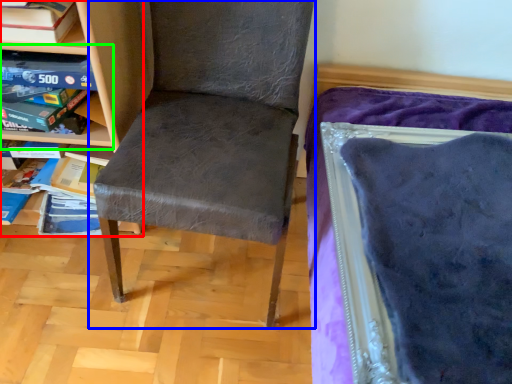
Question: Estimate the real-world distances between objects in this image. Which object is closer to shelf (highlighted by a red box), chair (highlighted by a blue box) or shelf (highlighted by a green box)?

Choices:
 (A) chair
 (B) shelf

Answer: (B)